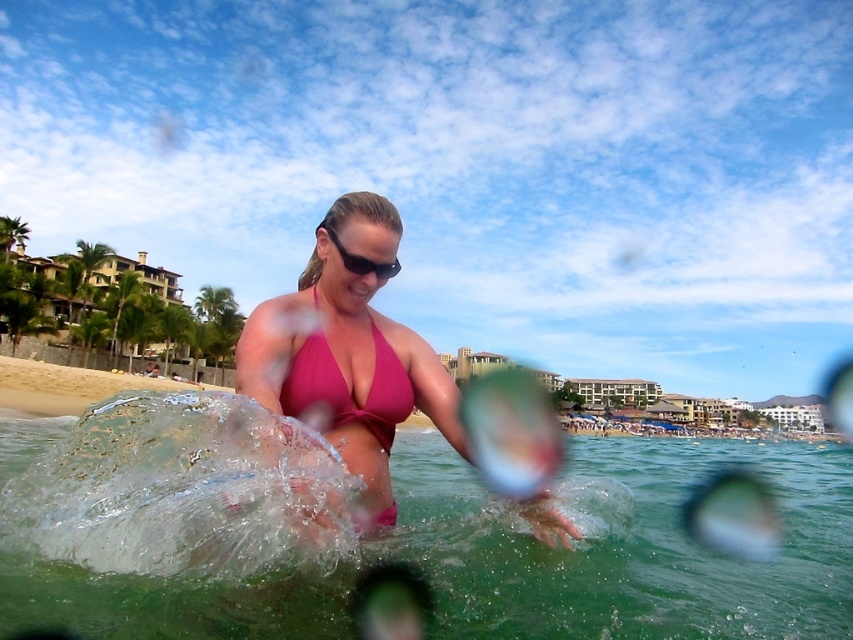
Is point (1, 580) in front of point (322, 365)?

That is True.

From the picture: Which is more to the right, clear water at center or pink matte bikini top at center?

clear water at center is more to the right.

Image resolution: width=853 pixels, height=640 pixels. What are the coordinates of `clear water at center` in the screenshot? It's located at (628, 545).

Does point (451, 412) lie behind point (368, 273)?

Yes, it is behind point (368, 273).

Find the location of a particular element. This screenshot has width=853, height=640. pink matte bikini at center is located at coordinates (345, 371).

Is clear water at center bigger than black plastic sunglasses at center?

Correct, clear water at center is larger in size than black plastic sunglasses at center.

Who is positioned more to the right, clear water at center or black plastic sunglasses at center?

clear water at center

Does point (479, 620) come in front of point (329, 225)?

Yes, point (479, 620) is in front of point (329, 225).

Image resolution: width=853 pixels, height=640 pixels. Find the location of `clear water at center`. clear water at center is located at coordinates (628, 545).